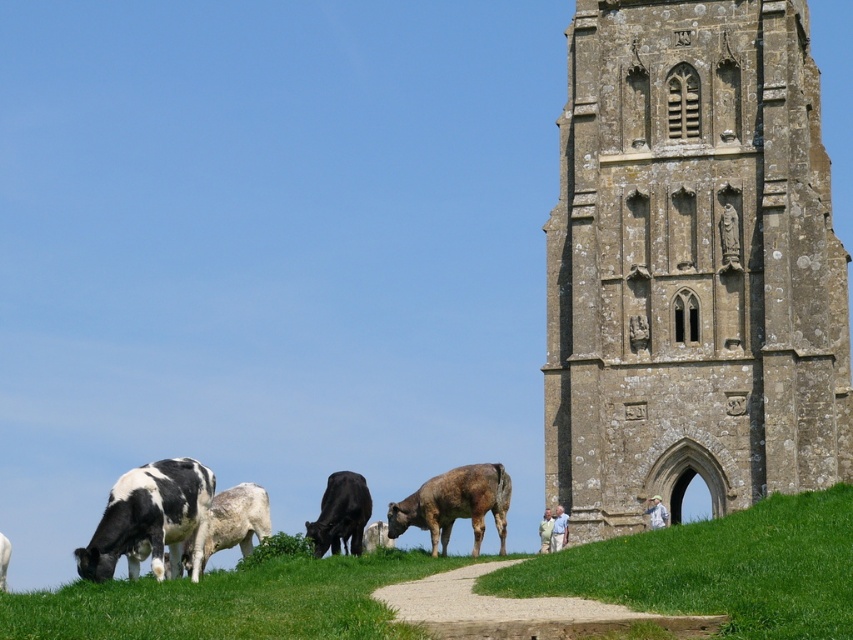
Is the position of brown stone tower at right less distant than that of black-and-white spotted cow at lower left?

No, brown stone tower at right is further to the viewer.

Which is more to the left, brown stone tower at right or black-and-white spotted cow at lower left?

black-and-white spotted cow at lower left is more to the left.

The width and height of the screenshot is (853, 640). In order to click on brown stone tower at right in this screenshot , I will do `click(692, 264)`.

Image resolution: width=853 pixels, height=640 pixels. What are the coordinates of `brown stone tower at right` in the screenshot? It's located at click(x=692, y=264).

Can you confirm if brown stone tower at right is bigger than green grass at lower right?

Yes.

Is point (613, 42) behind point (544, 582)?

That is True.

The width and height of the screenshot is (853, 640). In order to click on brown stone tower at right in this screenshot , I will do `click(692, 264)`.

Who is shorter, black-and-white spotted cow at lower left or brown rough cow at lower center?

brown rough cow at lower center is shorter.

Find the location of a particular element. This screenshot has height=640, width=853. black-and-white spotted cow at lower left is located at coordinates (149, 518).

This screenshot has width=853, height=640. Find the location of `black-and-white spotted cow at lower left`. black-and-white spotted cow at lower left is located at coordinates (149, 518).